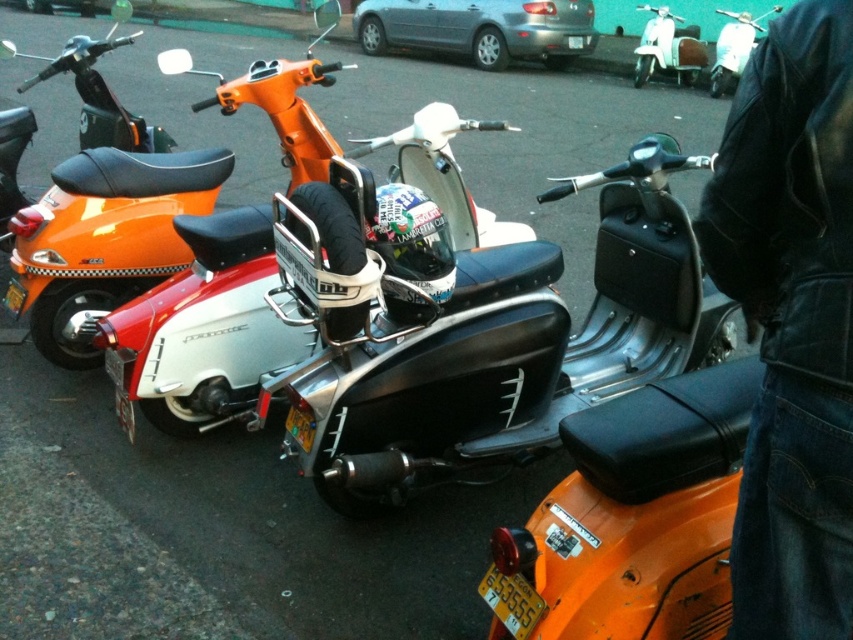
Does metallic silver scooter at upper center have a smaller size compared to yellow metallic license plate at center?

No, metallic silver scooter at upper center is not smaller than yellow metallic license plate at center.

Is point (659, 17) behind point (131, 412)?

That is True.

Locate an element on the screen. The image size is (853, 640). metallic silver scooter at upper center is located at coordinates (668, 49).

Does yellow metallic license plate at lower center come in front of matte orange scooter at upper right?

Yes, yellow metallic license plate at lower center is closer to the viewer.

Does yellow metallic license plate at lower center have a smaller size compared to matte orange scooter at upper right?

Yes.

At what (x,y) coordinates should I click in order to perform the action: click on yellow metallic license plate at lower center. Please return your answer as a coordinate pair (x, y). The height and width of the screenshot is (640, 853). Looking at the image, I should click on (511, 600).

Is silver metallic scooter at center behind metallic silver scooter at upper center?

No, silver metallic scooter at center is in front of metallic silver scooter at upper center.

Is point (456, 113) less distant than point (659, 38)?

That is True.

The height and width of the screenshot is (640, 853). What are the coordinates of `silver metallic scooter at center` in the screenshot? It's located at (204, 326).